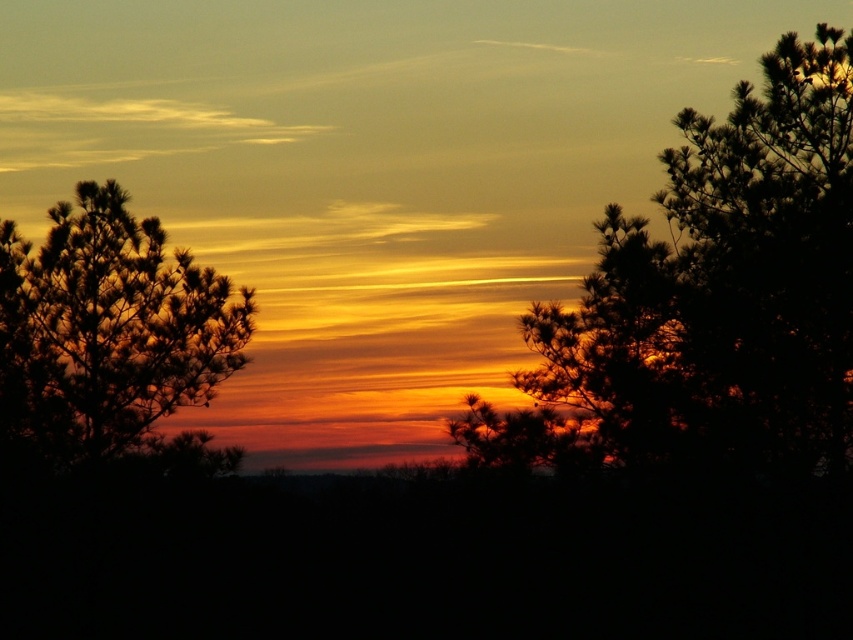
Question: Among these objects, which one is nearest to the camera?

Choices:
 (A) silhouette pine tree at left
 (B) dark green textured tree at right

Answer: (B)

Question: Is dark green textured tree at right to the right of silhouette pine tree at left from the viewer's perspective?

Choices:
 (A) no
 (B) yes

Answer: (B)

Question: Is dark green textured tree at right smaller than silhouette pine tree at left?

Choices:
 (A) yes
 (B) no

Answer: (B)

Question: Can you confirm if dark green textured tree at right is smaller than silhouette pine tree at left?

Choices:
 (A) no
 (B) yes

Answer: (A)

Question: Which of the following is the closest to the observer?

Choices:
 (A) silhouette pine tree at left
 (B) dark green textured tree at right

Answer: (B)